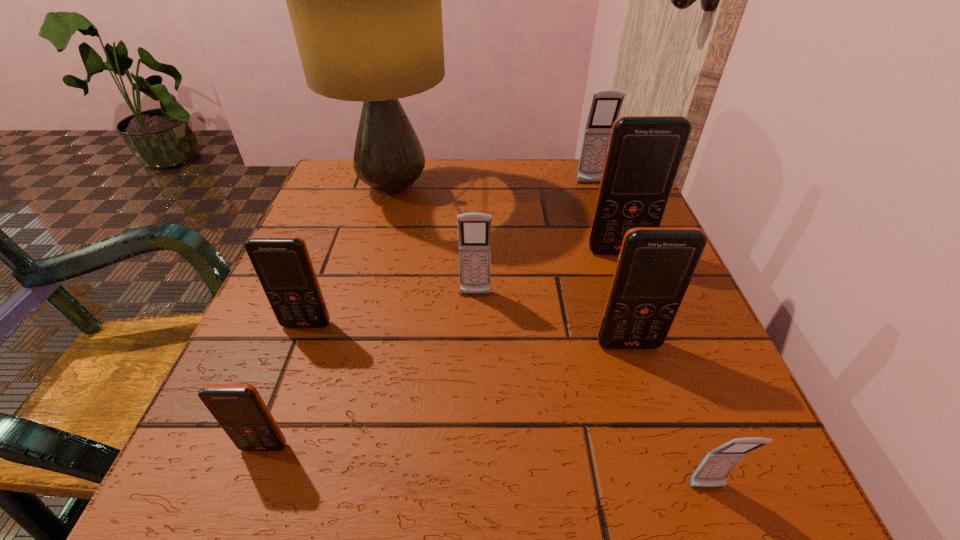
Where is `free space between the nearest cellular telephone and the third nearest cellular telephone`? free space between the nearest cellular telephone and the third nearest cellular telephone is located at coordinates (667, 416).

I want to click on free space between the smallest gray cellular telephone and the seventh farthest object, so click(486, 467).

Identify the location of free space between the third farthest orange cellular telephone and the nearest cellular telephone. This screenshot has height=540, width=960. (667, 416).

In order to click on free space between the leftmost gray cellular telephone and the lampshade in this screenshot , I will do `click(435, 241)`.

Identify the location of free space between the fifth farthest cellular telephone and the nearest cellular telephone. (667, 416).

Find the location of a particular element. vacant area between the second biggest gray cellular telephone and the tallest cellular telephone is located at coordinates (547, 273).

At what (x,y) coordinates should I click in order to perform the action: click on object that stands as the fourth closest to the smallest gray cellular telephone. Please return your answer as a coordinate pair (x, y). The height and width of the screenshot is (540, 960). Looking at the image, I should click on (239, 409).

Where is `object that is the second closest to the leftmost gray cellular telephone`? object that is the second closest to the leftmost gray cellular telephone is located at coordinates (644, 153).

The height and width of the screenshot is (540, 960). I want to click on cellular telephone identified as the fourth closest to the second biggest gray cellular telephone, so click(x=239, y=409).

Locate which cellular telephone is the sixth closest to the third farthest object. Please provide its 2D coordinates. Your answer should be formatted as a tuple, i.e. [(x, y)], where the tuple contains the x and y coordinates of a point satisfying the conditions above.

[(239, 409)]